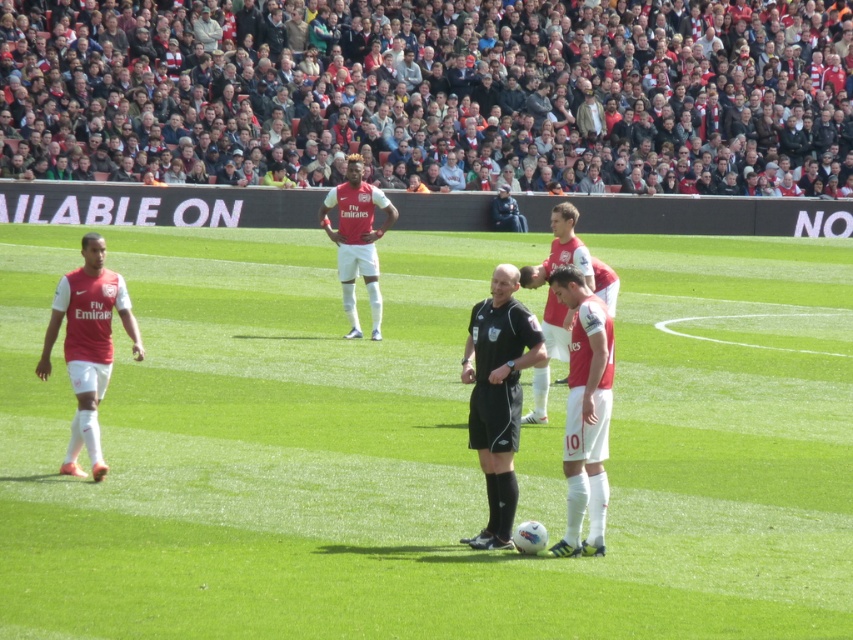
Question: Which point is closer to the camera?

Choices:
 (A) [x=102, y=276]
 (B) [x=616, y=355]
 (C) [x=543, y=268]
 (D) [x=506, y=212]

Answer: (A)

Question: Does white matte jersey at center appear on the left side of matte red jersey at left?

Choices:
 (A) yes
 (B) no

Answer: (B)

Question: Among these points, which one is farthest from the camera?

Choices:
 (A) (107, 372)
 (B) (329, 227)
 (C) (578, 342)
 (D) (131, 90)

Answer: (D)

Question: Is matte red jersey at center positioned in front of dark blue jersey at center?

Choices:
 (A) yes
 (B) no

Answer: (A)

Question: Where is matte red jersey at center located in relation to dark blue jersey at center in the image?

Choices:
 (A) above
 (B) below

Answer: (B)

Question: Which object is positioned farthest from the dark blue jersey at center?

Choices:
 (A) white matte soccer player at center
 (B) red fabric crowd at upper center
 (C) white matte jersey at center
 (D) matte red jersey at left

Answer: (C)